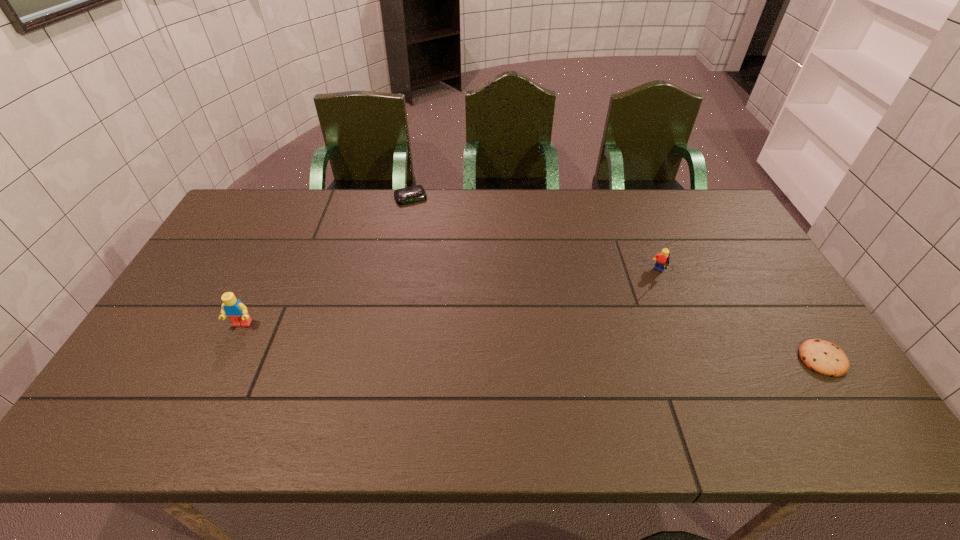
Locate an element on the screen. This screenshot has width=960, height=540. free space that satisfies the following two spatial constraints: 1. on the front side of the right Lego; 2. on the right side of the cookie is located at coordinates (695, 360).

Locate an element on the screen. Image resolution: width=960 pixels, height=540 pixels. vacant space that satisfies the following two spatial constraints: 1. on the front side of the farthest object; 2. on the right side of the right Lego is located at coordinates (396, 273).

Locate an element on the screen. The height and width of the screenshot is (540, 960). vacant space that satisfies the following two spatial constraints: 1. on the front-facing side of the nearer Lego; 2. on the left side of the rightmost object is located at coordinates (225, 360).

This screenshot has width=960, height=540. What are the coordinates of `vacant space that satisfies the following two spatial constraints: 1. on the front side of the nearest object; 2. on the left side of the right Lego` in the screenshot? It's located at (695, 360).